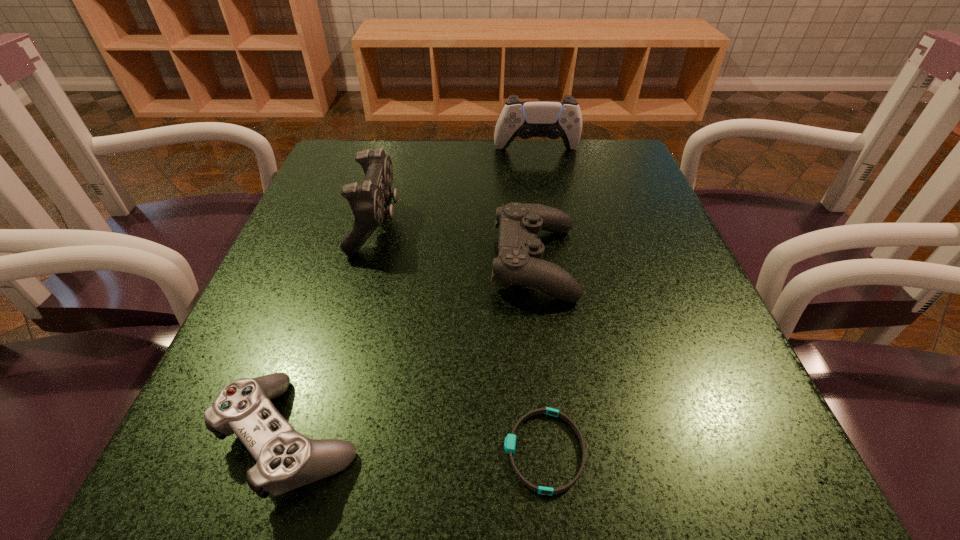
At what (x,y) coordinates should I click in order to perform the action: click on control that can be found as the second closest to the farthest object. Please return your answer as a coordinate pair (x, y). Looking at the image, I should click on (519, 262).

The image size is (960, 540). I want to click on vacant point that satisfies the following two spatial constraints: 1. on the front-facing side of the farthest control; 2. on the buckle of the wristband, so click(x=592, y=451).